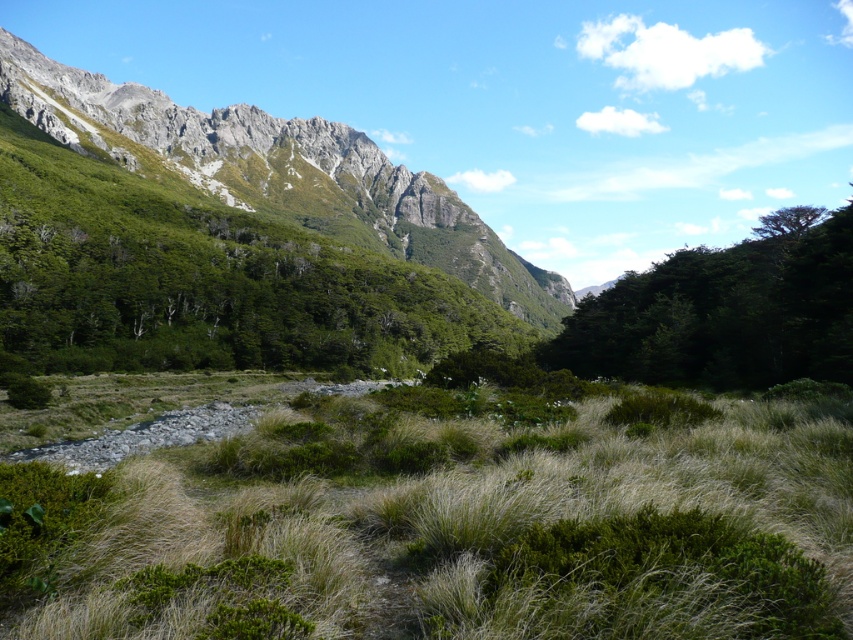
Between point (120, 522) and point (260, 150), which one is positioned in front?

Point (120, 522) is in front.

Is green grassy at center further to the viewer compared to gray rocky mountain at upper left?

No, it is in front of gray rocky mountain at upper left.

Is point (421, 406) farther from viewer compared to point (561, 284)?

That is False.

Image resolution: width=853 pixels, height=640 pixels. What are the coordinates of `green grassy at center` in the screenshot? It's located at (474, 525).

Does green grassy at center appear under green matte tree at center-right?

Yes, green grassy at center is below green matte tree at center-right.

Is point (120, 595) behind point (761, 273)?

No, it is not.

Find the location of a particular element. Image resolution: width=853 pixels, height=640 pixels. green grassy at center is located at coordinates (474, 525).

Between gray rocky mountain at upper left and green leafy tree at upper right, which one is positioned higher?

Positioned higher is gray rocky mountain at upper left.

Which is in front, point (393, 234) or point (809, 211)?

Positioned in front is point (809, 211).

Which is in front, point (96, 81) or point (791, 218)?

Point (791, 218) is more forward.

Identify the location of gray rocky mountain at upper left. This screenshot has height=640, width=853. (282, 173).